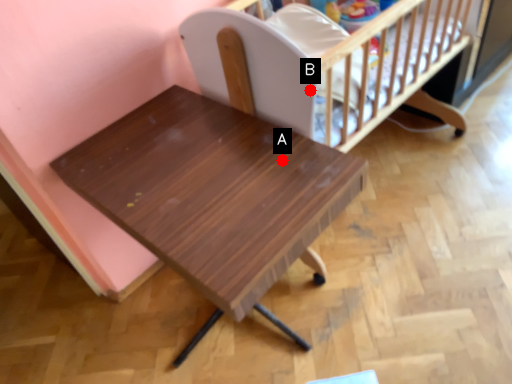
Question: Two points are circled on the image, labeled by A and B beside each circle. Which of the following is the closest to the observer?

Choices:
 (A) A is closer
 (B) B is closer

Answer: (B)